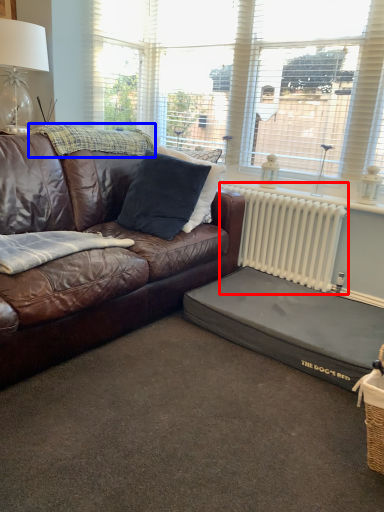
Question: Which of the following is the closest to the observer, radiator (highlighted by a red box) or blanket (highlighted by a blue box)?

Choices:
 (A) radiator
 (B) blanket

Answer: (B)